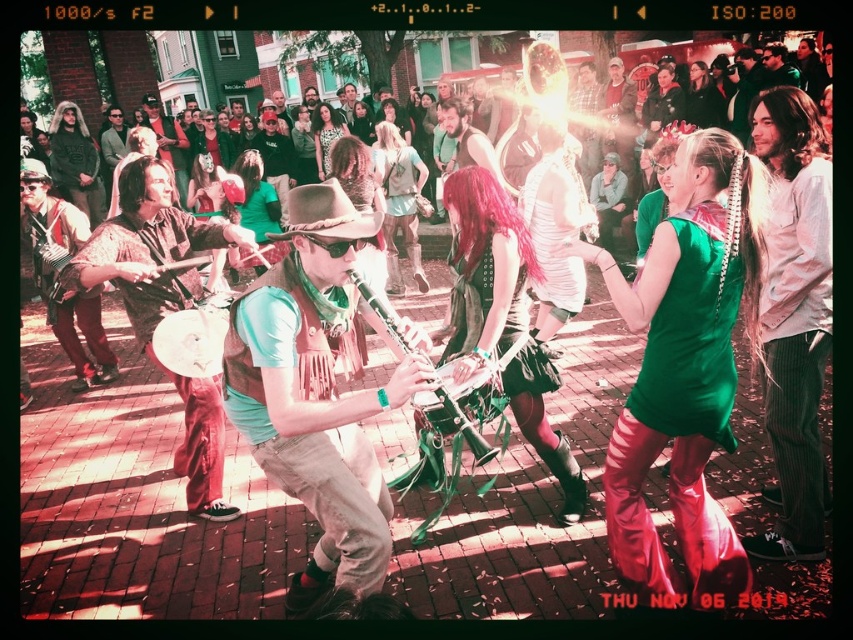
Question: Which object appears closest to the camera in this image?

Choices:
 (A) metallic green clarinet at center
 (B) matte green shirt at center

Answer: (B)

Question: Does matte green shirt at center have a larger size compared to metallic green clarinet at center?

Choices:
 (A) yes
 (B) no

Answer: (A)

Question: Which object is farther from the camera taking this photo?

Choices:
 (A) matte green shirt at center
 (B) metallic green clarinet at center

Answer: (B)

Question: Is matte green shirt at center to the left of metallic green clarinet at center from the viewer's perspective?

Choices:
 (A) no
 (B) yes

Answer: (B)

Question: Among these objects, which one is nearest to the camera?

Choices:
 (A) matte green shirt at center
 (B) metallic green clarinet at center

Answer: (A)

Question: Is matte green shirt at center behind metallic green clarinet at center?

Choices:
 (A) no
 (B) yes

Answer: (A)